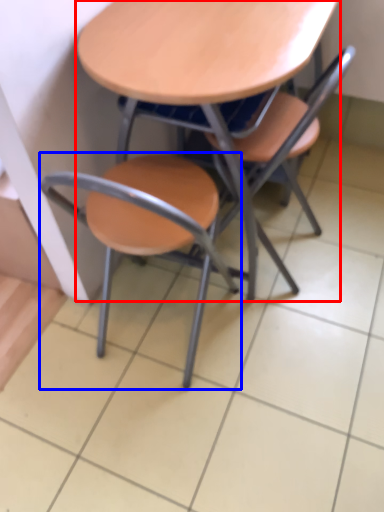
Question: Which object appears closest to the camera in this image, table (highlighted by a red box) or chair (highlighted by a blue box)?

Choices:
 (A) table
 (B) chair

Answer: (B)